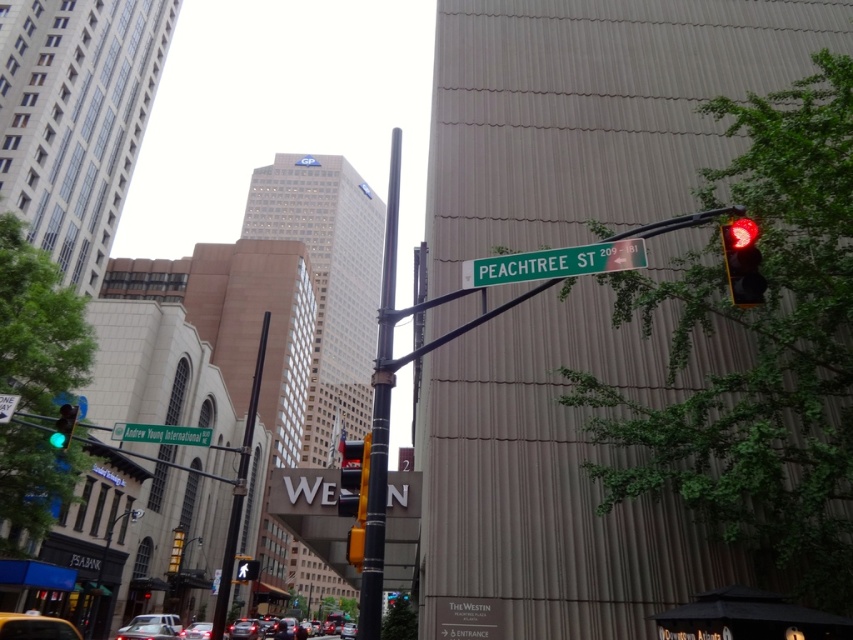
You are a pedestrian waiting at the crosswalk and see the green metallic street sign at upper left and the red glass pedestrian signal at center. Which object is located above the other?

The green metallic street sign at upper left is positioned over the red glass pedestrian signal at center.

You are a pedestrian standing on the sidewalk and see the green leafy tree at right and the green metallic street sign at upper center. Which object is closer to the ground?

The green leafy tree at right is closer to the ground because it is positioned below the green metallic street sign at upper center.

You are a city planner analyzing the urban layout. The green metallic street sign at upper left and the red glass pedestrian signal at center are both important for navigation. Which of these two objects takes up more visual space in the scene?

The red glass pedestrian signal at center takes up more visual space than the green metallic street sign at upper left because the green metallic street sign at upper left occupies less space than red glass pedestrian signal at center.